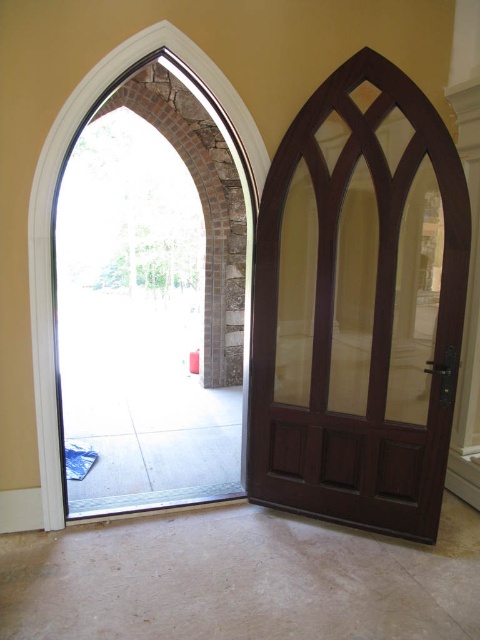
Can you confirm if clear glass door at center is positioned to the right of mahogany wood door at right?

Incorrect, clear glass door at center is not on the right side of mahogany wood door at right.

The width and height of the screenshot is (480, 640). I want to click on clear glass door at center, so click(151, 301).

Where is `clear glass door at center`? The width and height of the screenshot is (480, 640). clear glass door at center is located at coordinates (151, 301).